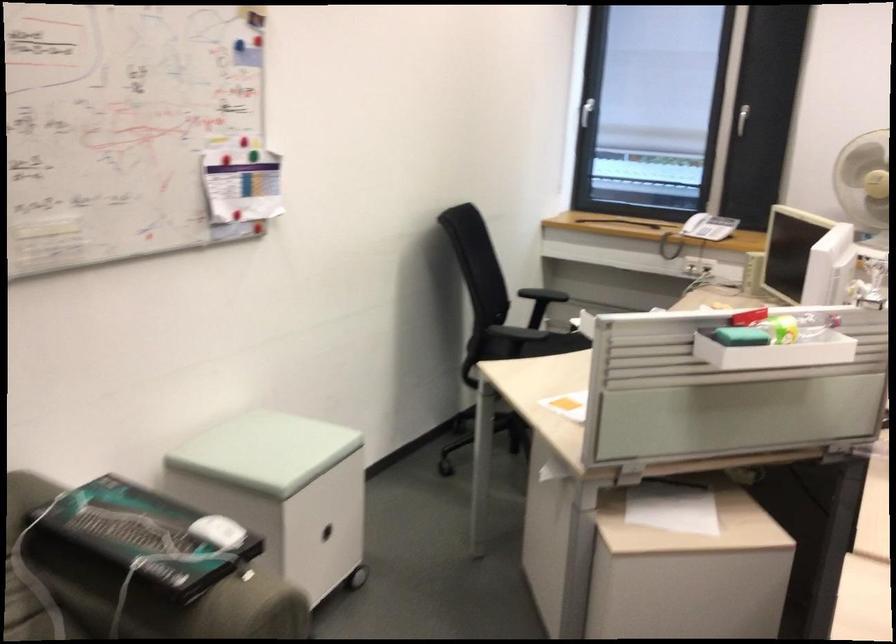
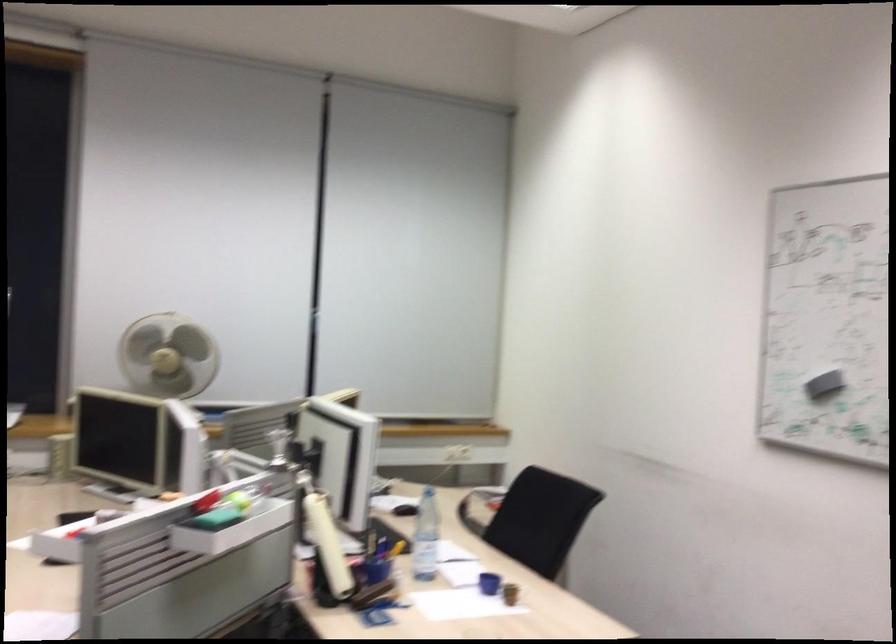
Question: The first image is from the beginning of the video and the second image is from the end. How did the camera likely rotate when shooting the video?

Choices:
 (A) Left
 (B) Right
 (C) Up
 (D) Down

Answer: (B)